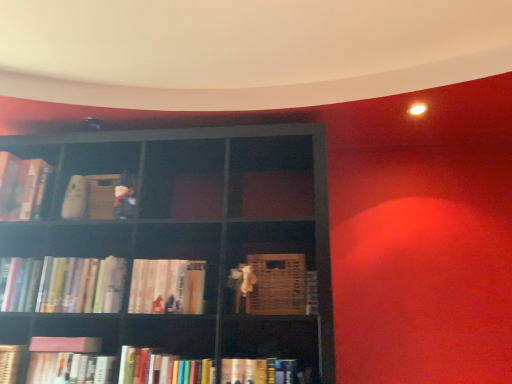
Question: Which direction should I rotate to look at hardcover books at center, the 7th book from the left?

Choices:
 (A) right
 (B) left

Answer: (B)

Question: Considering the relative positions of hardcover book at lower center, which ranks as the second book in right-to-left order, and hardcover books at left, the fifth book viewed from the right, in the image provided, is hardcover book at lower center, which ranks as the second book in right-to-left order, to the right of hardcover books at left, the fifth book viewed from the right, from the viewer's perspective?

Choices:
 (A) no
 (B) yes

Answer: (B)

Question: Is hardcover books at left, arranged as the 6th book when viewed from the left, located within hardcover book at lower center, the ninth book in the left-to-right sequence?

Choices:
 (A) yes
 (B) no

Answer: (B)

Question: Is hardcover book at lower center, the ninth book in the left-to-right sequence, shorter than hardcover books at left, arranged as the 6th book when viewed from the left?

Choices:
 (A) no
 (B) yes

Answer: (B)

Question: Considering the relative sizes of hardcover book at lower center, the ninth book in the left-to-right sequence, and hardcover books at left, the fifth book viewed from the right, in the image provided, is hardcover book at lower center, the ninth book in the left-to-right sequence, taller than hardcover books at left, the fifth book viewed from the right,?

Choices:
 (A) no
 (B) yes

Answer: (A)

Question: Is hardcover book at lower center, which ranks as the second book in right-to-left order, positioned with its back to hardcover books at left, the fifth book viewed from the right?

Choices:
 (A) no
 (B) yes

Answer: (A)

Question: From the image's perspective, is hardcover book at lower center, the ninth book in the left-to-right sequence, under hardcover books at left, the fifth book viewed from the right?

Choices:
 (A) yes
 (B) no

Answer: (A)

Question: Does hardcover book at lower left, acting as the 6th book starting from the right, have a smaller size compared to hardcover books at center, the 7th book from the left?

Choices:
 (A) yes
 (B) no

Answer: (A)

Question: Does hardcover book at lower left, which is the 5th book from left to right, appear on the left side of hardcover books at center, the 4th book positioned from the right?

Choices:
 (A) yes
 (B) no

Answer: (A)

Question: From a real-world perspective, is hardcover book at lower left, which is the 5th book from left to right, on top of hardcover books at center, the 4th book positioned from the right?

Choices:
 (A) yes
 (B) no

Answer: (B)

Question: Could hardcover books at center, the 4th book positioned from the right, be considered to be inside hardcover book at lower left, which is the 5th book from left to right?

Choices:
 (A) yes
 (B) no

Answer: (B)

Question: Is the surface of hardcover book at lower left, which is the 5th book from left to right, in direct contact with hardcover books at center, the 4th book positioned from the right?

Choices:
 (A) yes
 (B) no

Answer: (B)

Question: Can you confirm if hardcover book at lower left, which is the 5th book from left to right, is positioned to the right of hardcover books at center, the 7th book from the left?

Choices:
 (A) no
 (B) yes

Answer: (A)

Question: Considering the relative sizes of hardcover books at lower center, positioned as the 8th book in left-to-right order, and hardcover book at lower left, which is the 5th book from left to right, in the image provided, is hardcover books at lower center, positioned as the 8th book in left-to-right order, thinner than hardcover book at lower left, which is the 5th book from left to right,?

Choices:
 (A) no
 (B) yes

Answer: (A)